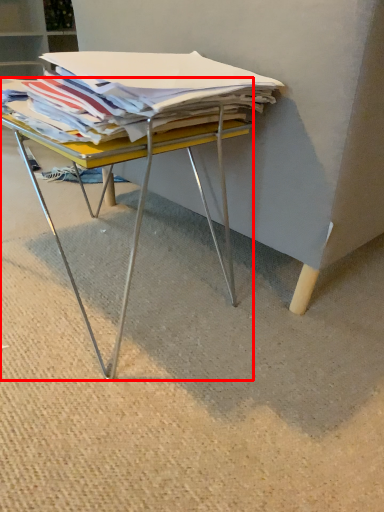
Question: From the image's perspective, considering the relative positions of desk (annotated by the red box) and magazine in the image provided, where is desk (annotated by the red box) located with respect to the staircase?

Choices:
 (A) above
 (B) below

Answer: (B)